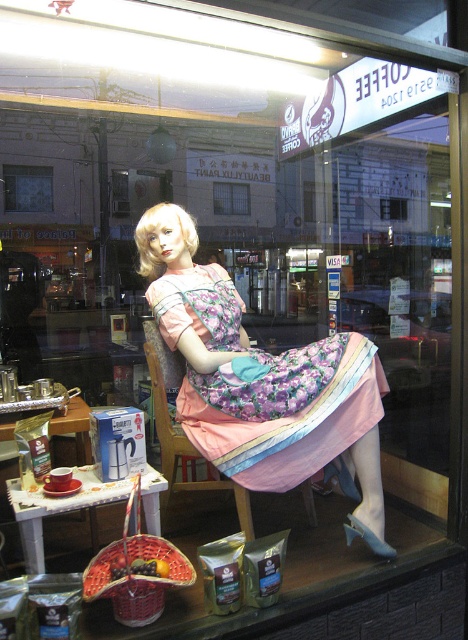
Who is positioned more to the left, wooden chair at center or transparent glass window at upper left?

From the viewer's perspective, transparent glass window at upper left appears more on the left side.

Between point (175, 492) and point (21, 186), which one is positioned in front?

Point (175, 492) is in front.

Where is `wooden chair at center`? Image resolution: width=468 pixels, height=640 pixels. wooden chair at center is located at coordinates (182, 433).

Between floral fabric dress at center and wooden chair at center, which one appears on the right side from the viewer's perspective?

floral fabric dress at center is more to the right.

Between floral fabric dress at center and wooden chair at center, which one is positioned higher?

floral fabric dress at center is higher up.

Is point (148, 225) farther from camera compared to point (153, 356)?

That is False.

You are a GUI agent. You are given a task and a screenshot of the screen. Output one action in this format:
    pyautogui.click(x=<x>, y=<y>)
    Task: Click on the floral fabric dress at center
    
    Given the screenshot: What is the action you would take?
    pyautogui.click(x=262, y=380)

Can you confirm if floral fabric dress at center is positioned to the right of transparent glass window at upper left?

Yes, floral fabric dress at center is to the right of transparent glass window at upper left.

Does floral fabric dress at center have a greater width compared to transparent glass window at upper left?

Indeed, floral fabric dress at center has a greater width compared to transparent glass window at upper left.

Between point (326, 394) and point (39, 182), which one is positioned behind?

The point (39, 182) is more distant.

Image resolution: width=468 pixels, height=640 pixels. Identify the location of floral fabric dress at center. (262, 380).